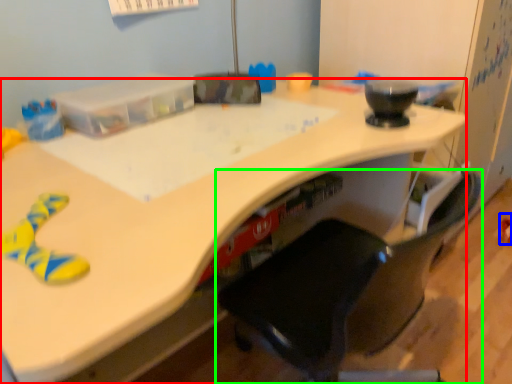
Question: Estimate the real-world distances between objects in this image. Which object is closer to desk (highlighted by a red box), toy (highlighted by a blue box) or chair (highlighted by a green box)?

Choices:
 (A) toy
 (B) chair

Answer: (B)